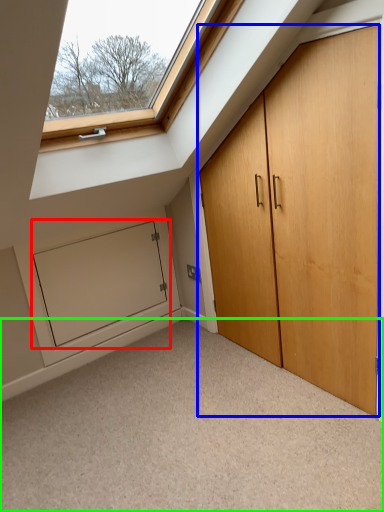
Question: Which object is the farthest from screen door (highlighted by a red box)? Choose among these: door (highlighted by a blue box) or corridor (highlighted by a green box).

Choices:
 (A) door
 (B) corridor

Answer: (A)